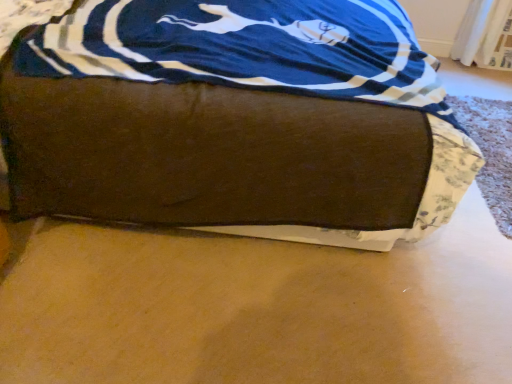
Where is `brown fabric bed at center`? brown fabric bed at center is located at coordinates (418, 210).

The width and height of the screenshot is (512, 384). What do you see at coordinates (418, 210) in the screenshot? I see `brown fabric bed at center` at bounding box center [418, 210].

Find the location of a particular element. brown fabric bed at center is located at coordinates (418, 210).